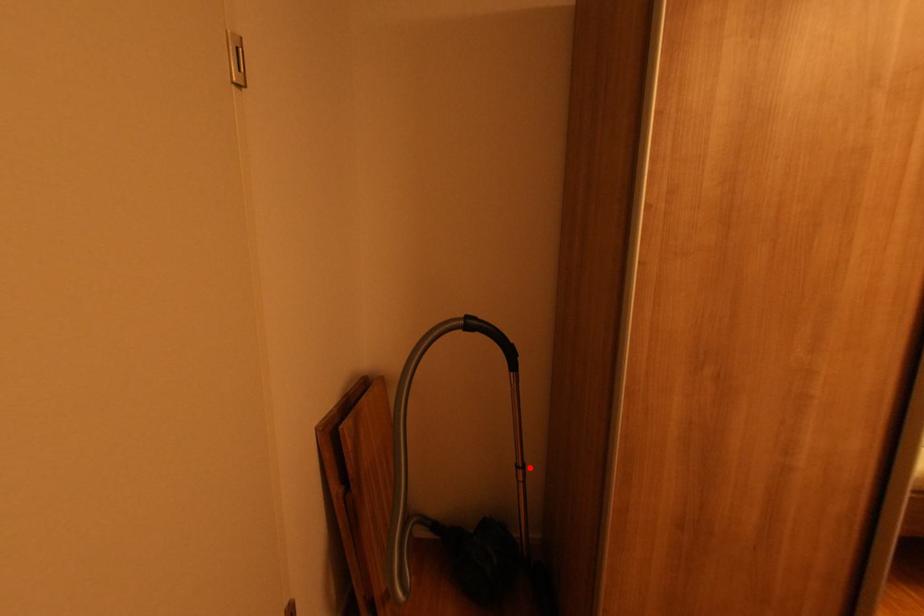
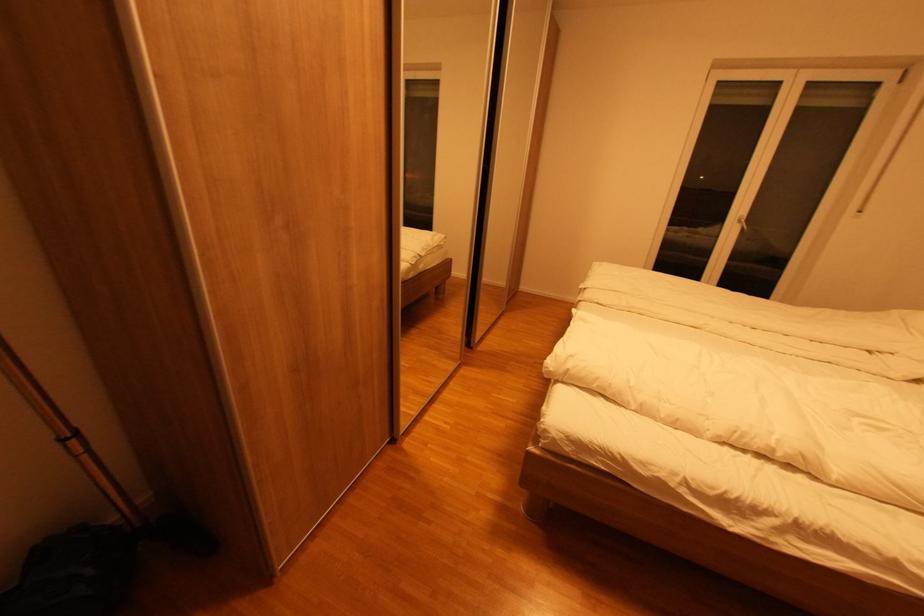
In the second image, find the point that corresponds to the highlighted location in the first image.

(83, 434)